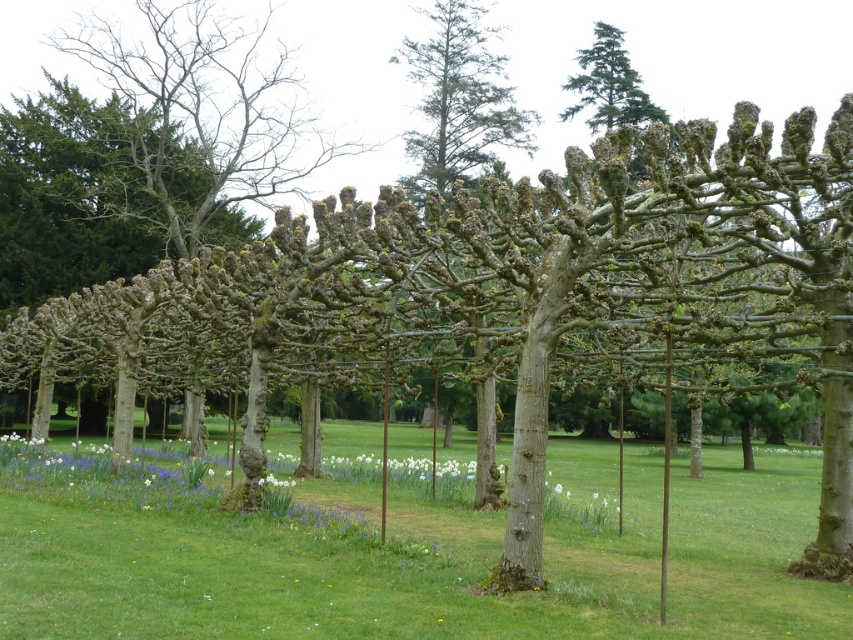
You are a gardener who wants to plant a new flower in the garden. You have a white matte flower at center and green grass at center. Which one has a wider spread when fully grown?

The green grass at center has a wider spread than the white matte flower at center, as the green grass at center is wider.

You are standing in the garden and notice two points marked in the scene. Which point, point [480,515] or point [279,481], is closer to you?

Point [480,515] is closer to the camera than point [279,481].